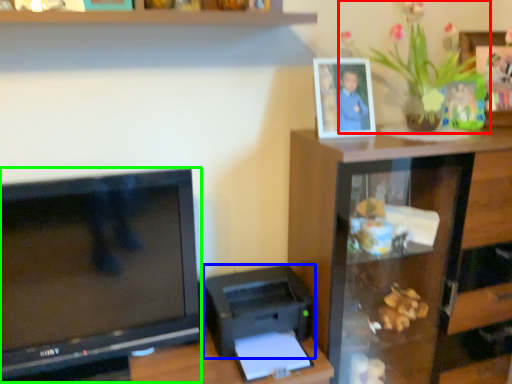
Question: Estimate the real-world distances between objects in this image. Which object is closer to houseplant (highlighted by a red box), printer (highlighted by a blue box) or television (highlighted by a green box)?

Choices:
 (A) printer
 (B) television

Answer: (A)